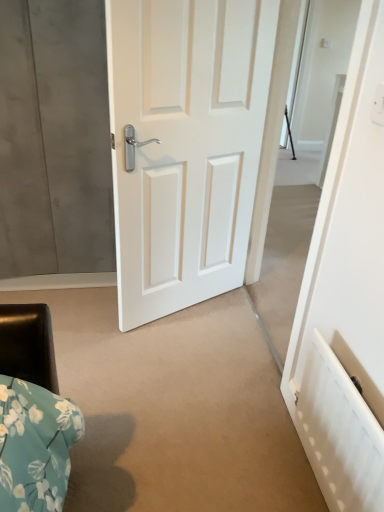
Question: Should I look upward or downward to see white textured radiator at lower right?

Choices:
 (A) up
 (B) down

Answer: (B)

Question: Considering the relative sizes of matte white door at center and white glossy door at center in the image provided, is matte white door at center bigger than white glossy door at center?

Choices:
 (A) no
 (B) yes

Answer: (A)

Question: Does matte white door at center have a lesser height compared to white glossy door at center?

Choices:
 (A) yes
 (B) no

Answer: (A)

Question: Is matte white door at center oriented towards white glossy door at center?

Choices:
 (A) no
 (B) yes

Answer: (A)

Question: Is matte white door at center not close to white glossy door at center?

Choices:
 (A) yes
 (B) no

Answer: (B)

Question: Is matte white door at center at the left side of white glossy door at center?

Choices:
 (A) yes
 (B) no

Answer: (A)

Question: Considering the relative sizes of matte white door at center and white glossy door at center in the image provided, is matte white door at center thinner than white glossy door at center?

Choices:
 (A) no
 (B) yes

Answer: (A)

Question: Considering the relative positions of white glossy door at center and white textured radiator at lower right in the image provided, is white glossy door at center to the left of white textured radiator at lower right from the viewer's perspective?

Choices:
 (A) no
 (B) yes

Answer: (B)

Question: Considering the relative sizes of white glossy door at center and white textured radiator at lower right in the image provided, is white glossy door at center taller than white textured radiator at lower right?

Choices:
 (A) no
 (B) yes

Answer: (B)

Question: Can you confirm if white glossy door at center is shorter than white textured radiator at lower right?

Choices:
 (A) no
 (B) yes

Answer: (A)

Question: Is white glossy door at center not close to white textured radiator at lower right?

Choices:
 (A) no
 (B) yes

Answer: (A)

Question: From a real-world perspective, is white glossy door at center below white textured radiator at lower right?

Choices:
 (A) yes
 (B) no

Answer: (B)

Question: Does white glossy door at center appear on the right side of white textured radiator at lower right?

Choices:
 (A) no
 (B) yes

Answer: (A)

Question: Can you confirm if white textured radiator at lower right is taller than white glossy door at center?

Choices:
 (A) yes
 (B) no

Answer: (B)